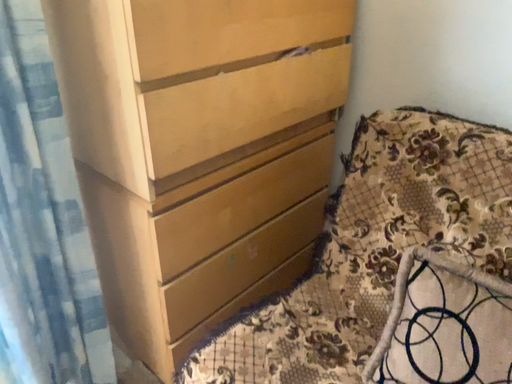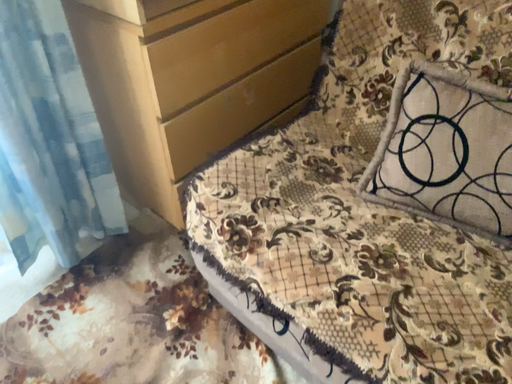
Question: Which way did the camera rotate in the video?

Choices:
 (A) rotated upward
 (B) rotated downward

Answer: (B)